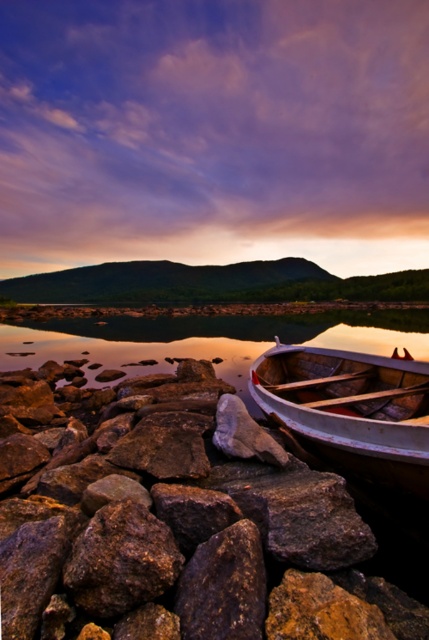
You are standing at the lakeside and want to move from the brown rough rock at center to the glossy water at boat right. In which direction should you walk?

You should walk to the left because the brown rough rock at center is to the right of the glossy water at boat right, so moving left will bring you towards the water.

You are standing at the center of the image and want to place a marker exactly at the location of the brown rough rock at center. What are the coordinates where you should place the marker?

The coordinates for the brown rough rock at center are at point (178, 529).